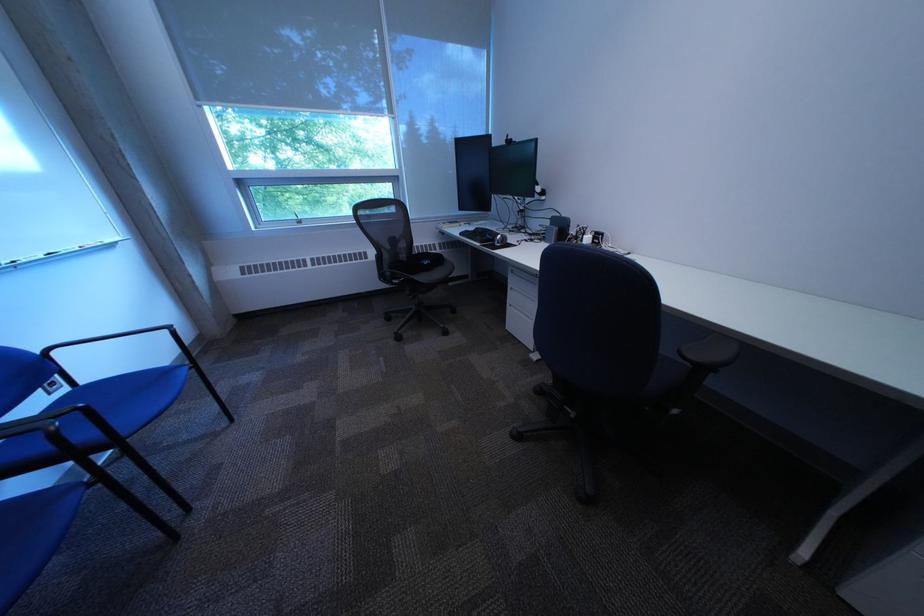
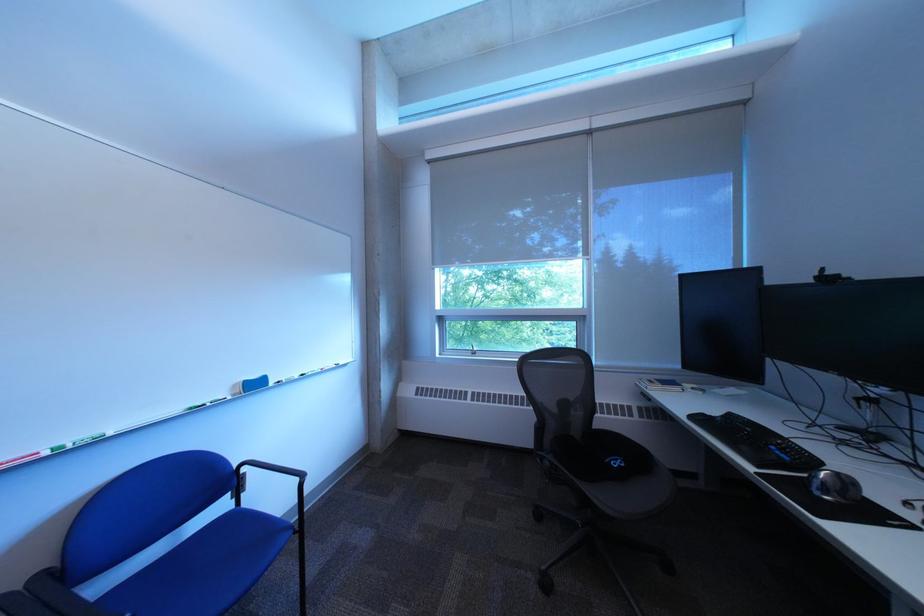
The point at (452, 229) is marked in the first image. Where is the corresponding point in the second image?

(651, 386)